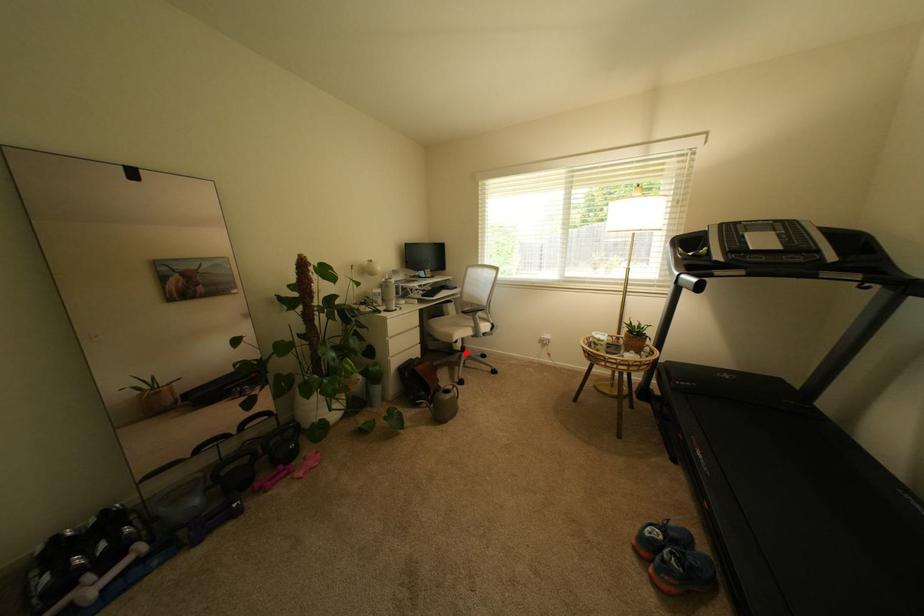
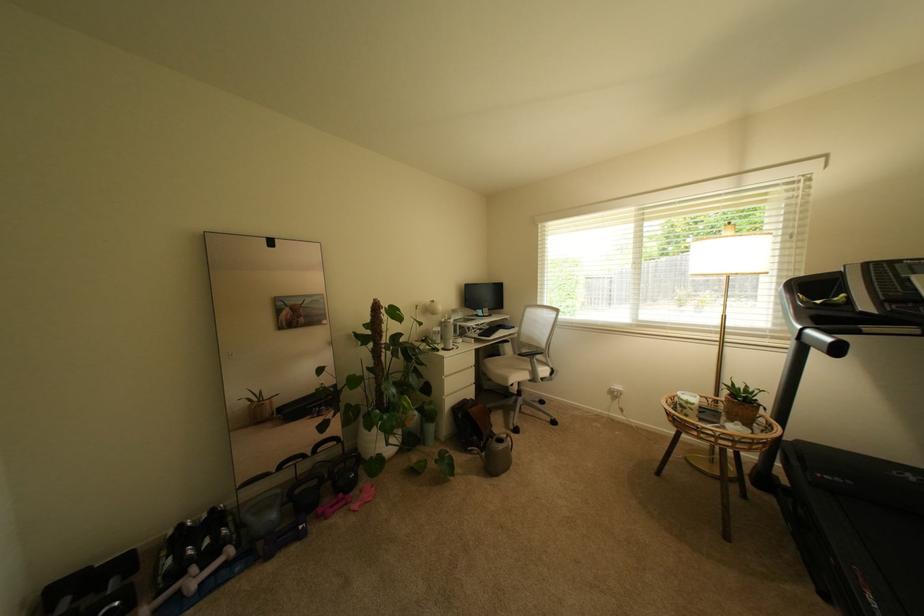
Question: I am providing you with two images of the same scene from different viewpoints. A red point is shown in image1. For the corresponding object point in image2, is it positioned nearer or farther from the camera?

Choices:
 (A) Nearer
 (B) Farther

Answer: (B)